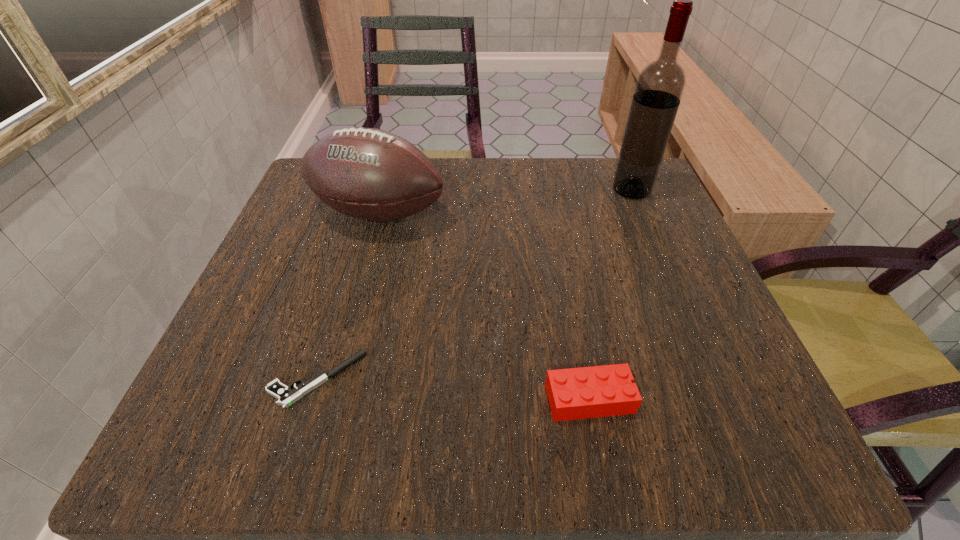
Where is `free location that satisfies the following two spatial constraints: 1. on the front side of the rightmost object; 2. on the front-facing side of the shortest object`? The height and width of the screenshot is (540, 960). free location that satisfies the following two spatial constraints: 1. on the front side of the rightmost object; 2. on the front-facing side of the shortest object is located at coordinates (711, 379).